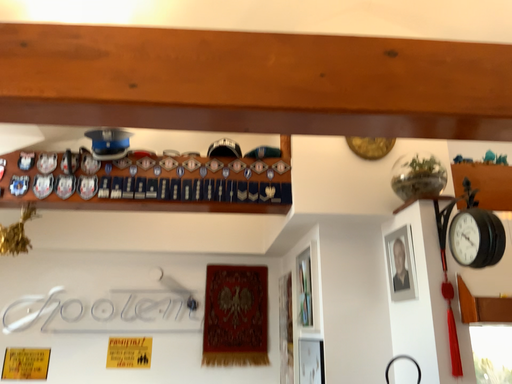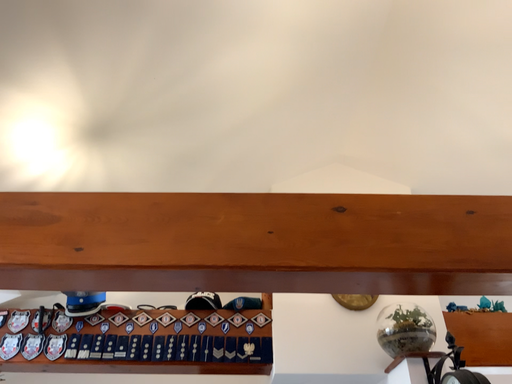
Question: Which way did the camera rotate in the video?

Choices:
 (A) rotated upward
 (B) rotated downward

Answer: (A)